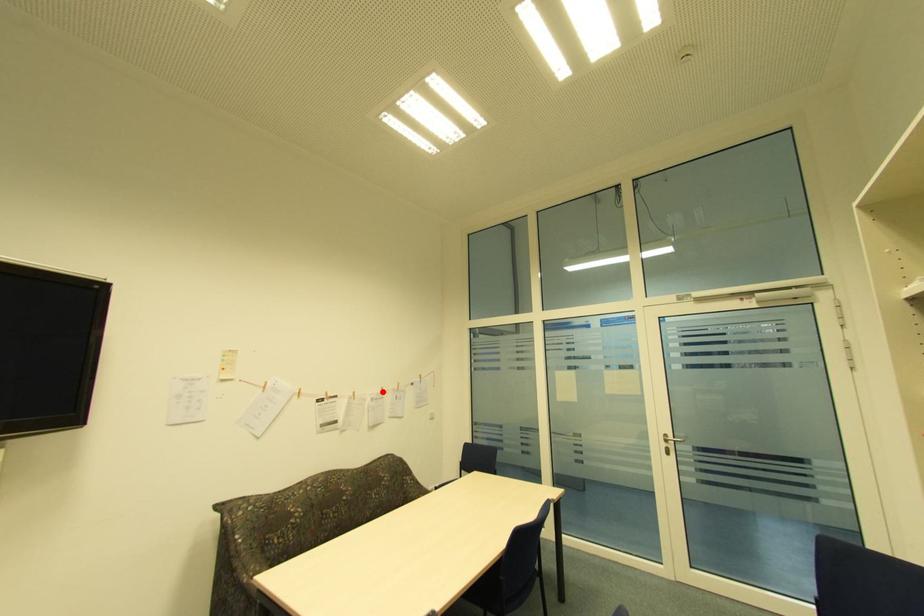
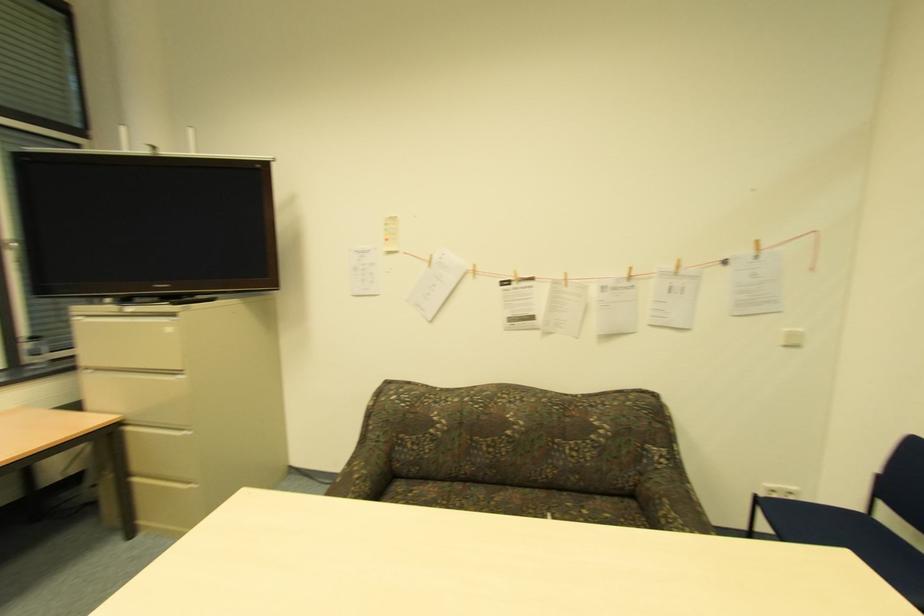
Question: I am providing you with two images of the same scene from different viewpoints. A red point is marked on the first image. Can you still see the location of the red point in image 2?

Choices:
 (A) Yes
 (B) No

Answer: (A)